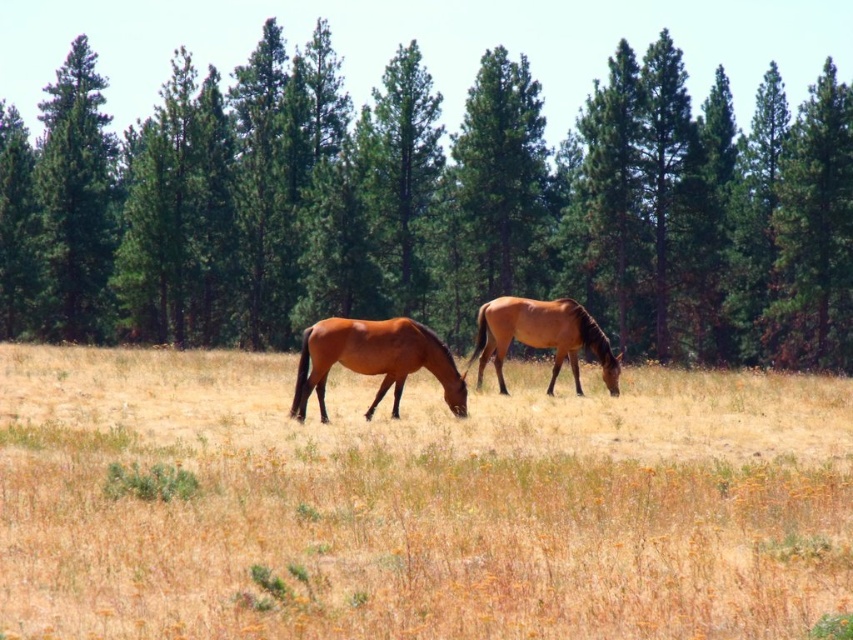
Question: Which point is farther from the camera taking this photo?

Choices:
 (A) (344, 360)
 (B) (576, 316)

Answer: (B)

Question: Which point is closer to the camera?

Choices:
 (A) (505, 532)
 (B) (502, 314)

Answer: (A)

Question: Is brown grass at center bigger than brown glossy horse at center?

Choices:
 (A) no
 (B) yes

Answer: (B)

Question: Does green leafy trees at center lie in front of brown glossy horse at center?

Choices:
 (A) yes
 (B) no

Answer: (B)

Question: Which of these objects is positioned closest to the brown glossy horse at center?

Choices:
 (A) brown grass at center
 (B) green leafy trees at center
 (C) shiny brown horse at center

Answer: (A)

Question: In this image, where is green leafy trees at center located relative to brown glossy horse at center?

Choices:
 (A) below
 (B) above

Answer: (B)